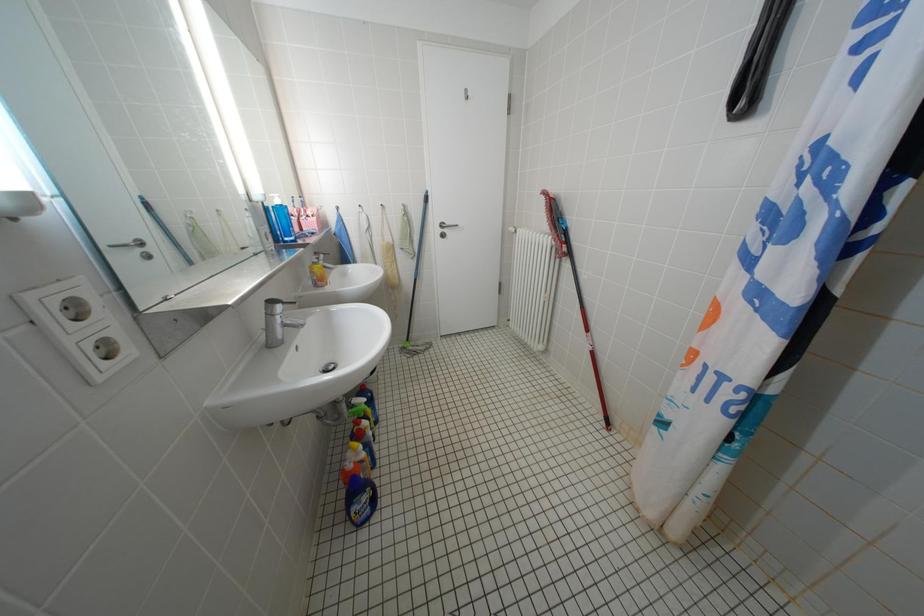
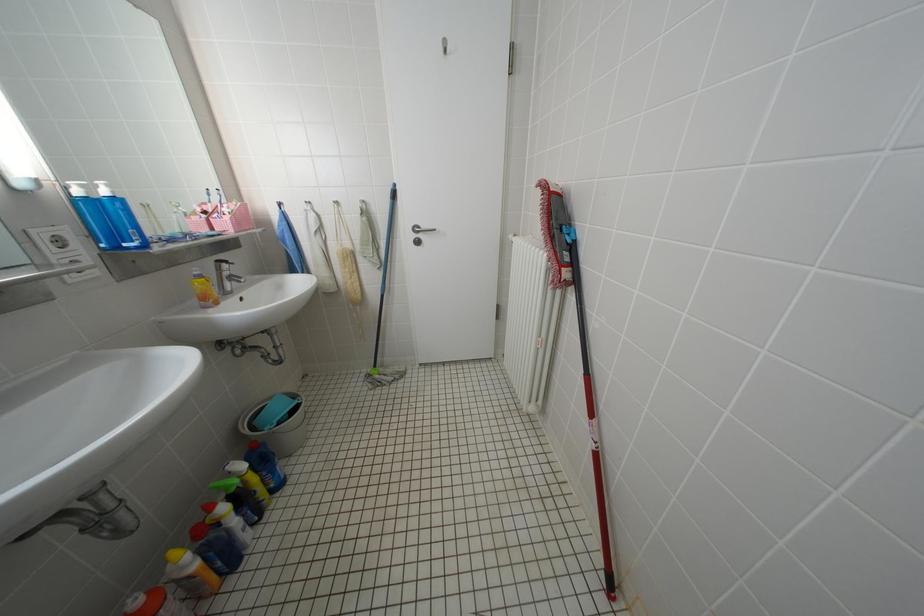
Looking at this image, in a continuous first-person perspective shot, in which direction is the camera moving?

The cameraman moved toward right, forward.